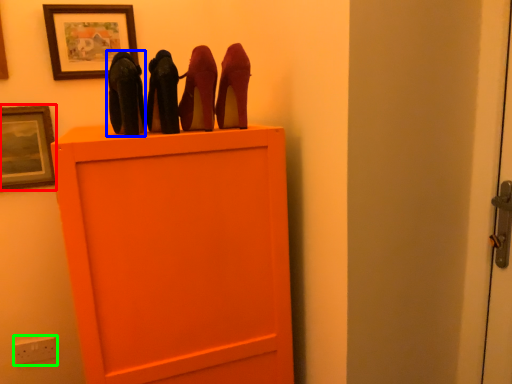
Question: Considering the real-world distances, which object is farthest from picture frame (highlighted by a red box)? high heels (highlighted by a blue box) or electric outlet (highlighted by a green box)?

Choices:
 (A) high heels
 (B) electric outlet

Answer: (B)